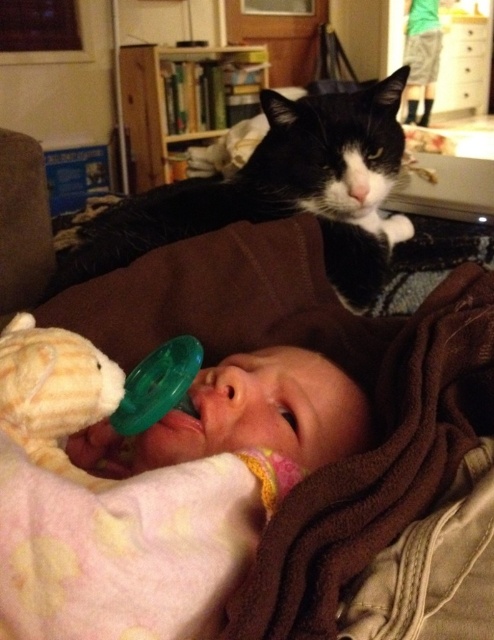
Is pink soft fabric baby at center bigger than black fur cat at upper center?

Incorrect, pink soft fabric baby at center is not larger than black fur cat at upper center.

The width and height of the screenshot is (494, 640). Describe the element at coordinates (167, 502) in the screenshot. I see `pink soft fabric baby at center` at that location.

Measure the distance between point (142, 568) and camera.

Point (142, 568) and camera are 11.55 inches apart.

Image resolution: width=494 pixels, height=640 pixels. Identify the location of pink soft fabric baby at center. (167, 502).